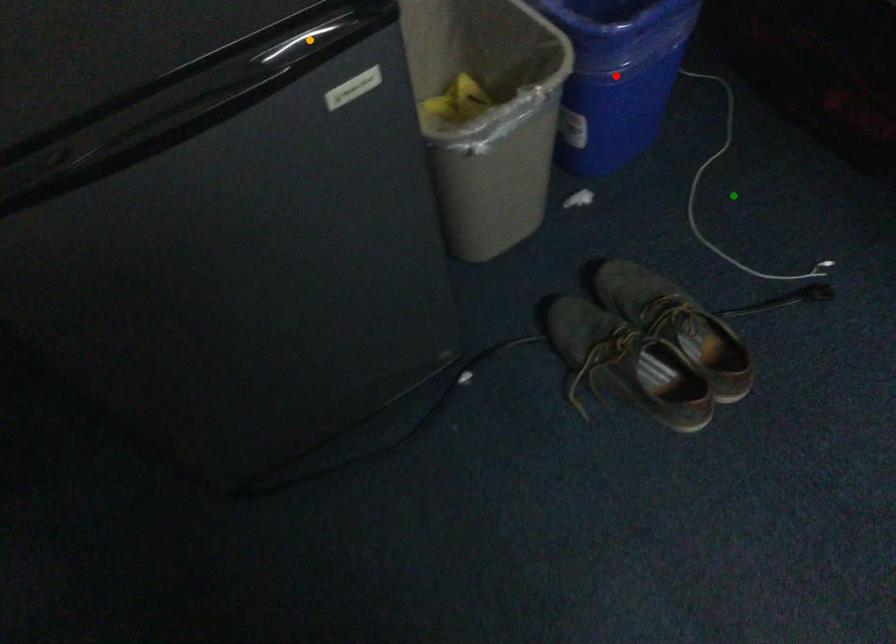
Order these from nearest to farthest:
- red point
- orange point
- green point

orange point, red point, green point